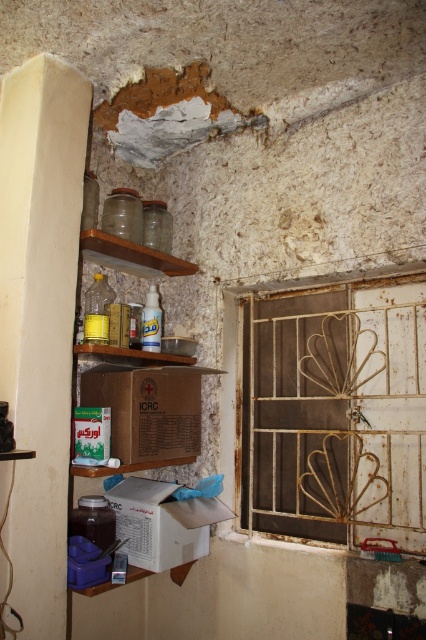
You are standing in the room and want to move from the point at coordinates point (138, 524) to the point at coordinates point (112, 243). Which direction should you face to walk towards the second point?

Since point (138, 524) is in front of point (112, 243), you should turn around and face the opposite direction to walk towards point (112, 243).